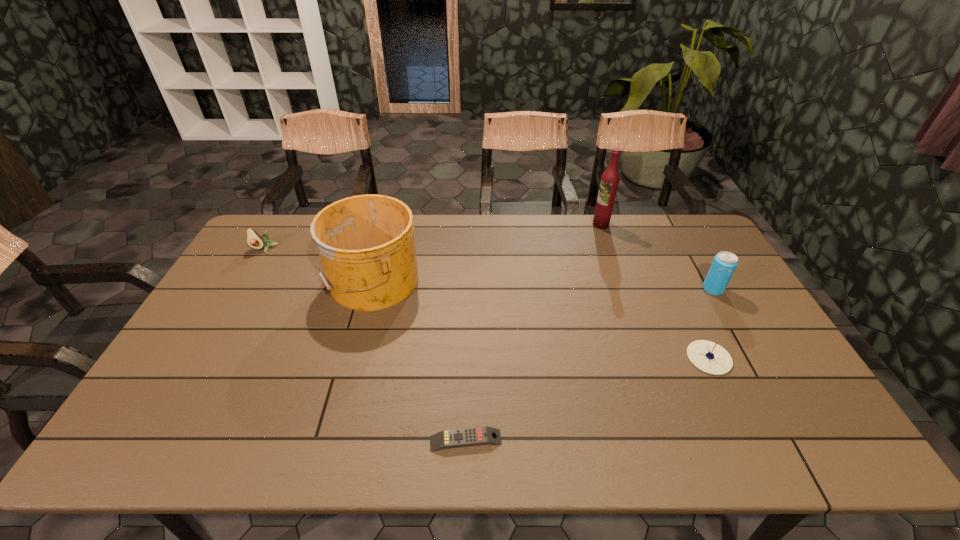
In the image, there is a desktop. What are the coordinates of `blank space at the right edge` in the screenshot? It's located at (720, 319).

Locate an element on the screen. This screenshot has height=540, width=960. vacant space at the far left corner of the desktop is located at coordinates [x=276, y=239].

Find the location of a particular element. free space at the far right corner of the desktop is located at coordinates (704, 230).

Where is `free spot between the fifth shortest object and the fourth shortest object`? free spot between the fifth shortest object and the fourth shortest object is located at coordinates (542, 285).

Locate an element on the screen. The width and height of the screenshot is (960, 540). free area in between the nearest object and the third shortest object is located at coordinates (365, 345).

Identify the location of free space between the leftmost object and the second shortest object. This screenshot has width=960, height=540. (487, 303).

You are a GUI agent. You are given a task and a screenshot of the screen. Output one action in this format:
    pyautogui.click(x=<x>, y=<y>)
    Task: Click on the free area in between the fifth shortest object and the shortest object
    The width and height of the screenshot is (960, 540).
    Given the screenshot: What is the action you would take?
    click(420, 360)

Where is `empty location between the fourth shortest object and the fourth tallest object`? empty location between the fourth shortest object and the fourth tallest object is located at coordinates (489, 269).

Find the location of a particular element. This screenshot has width=960, height=540. unoccupied position between the tallest object and the avocado is located at coordinates (432, 237).

You are a GUI agent. You are given a task and a screenshot of the screen. Output one action in this format:
    pyautogui.click(x=<x>, y=<y>)
    Task: Click on the vacant point located between the remote control and the bucket
    Image resolution: width=960 pixels, height=540 pixels.
    Given the screenshot: What is the action you would take?
    pyautogui.click(x=420, y=360)